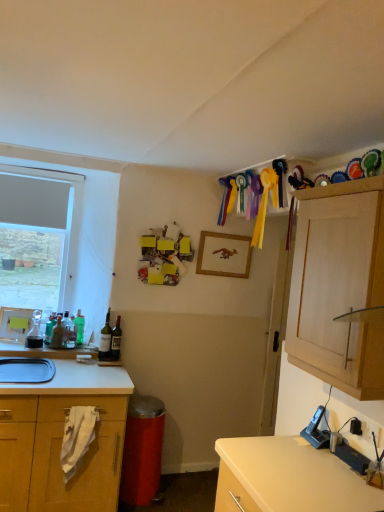
Question: From a real-world perspective, relative to matte white sink at lower left, is matte glass bottle at center left, arranged as the fifth bottle when viewed from the left, vertically above or below?

Choices:
 (A) above
 (B) below

Answer: (A)

Question: Considering the positions of point (100, 338) and point (16, 366), is point (100, 338) closer or farther from the camera than point (16, 366)?

Choices:
 (A) farther
 (B) closer

Answer: (A)

Question: Which object is positioned closest to the translucent glass bottle at left, which is the 2th bottle from left to right?

Choices:
 (A) wooden frame at center, the first picture frame viewed from the back
 (B) translucent glass carafe at left, arranged as the first bottle when viewed from the left
 (C) black plastic phone at lower right
 (D) matte white sink at lower left
 (E) light wood cabinet at upper right

Answer: (B)

Question: Estimate the real-world distances between objects in this image. Which object is farther from the light wood cabinet at upper right?

Choices:
 (A) translucent glass bottle at left, which is the 2th bottle from left to right
 (B) black plastic phone at lower right
 (C) dark brown glass bottle at left, the 6th bottle positioned from the left
 (D) translucent glass carafe at left, arranged as the 6th bottle when viewed from the right
 (E) green matte bottle at left, which is counted as the third bottle, starting from the right

Answer: (D)